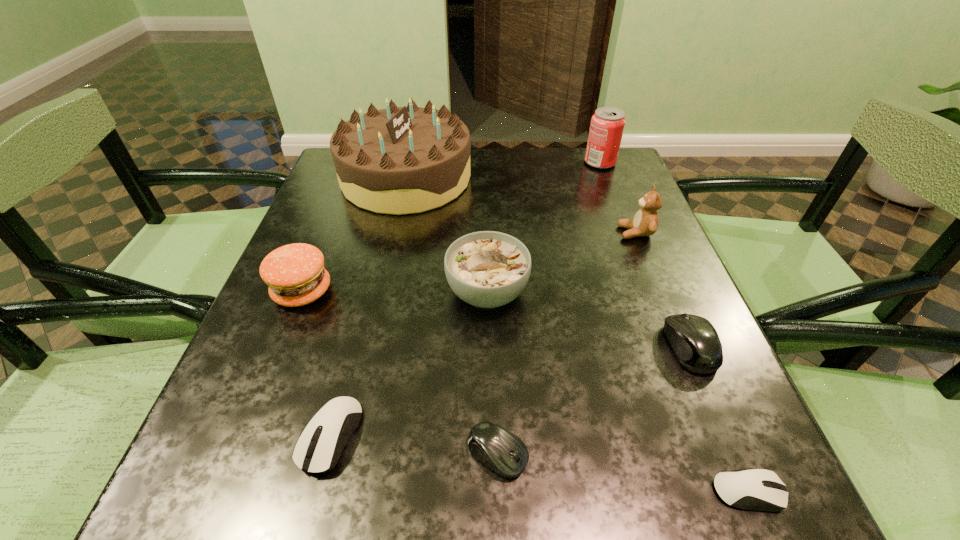
What are the coordinates of `mouse that is at the left edge` in the screenshot? It's located at (337, 420).

Image resolution: width=960 pixels, height=540 pixels. I want to click on soda can that is positioned at the right edge, so click(607, 125).

In order to click on teddy bear positioned at the right edge in this screenshot , I will do `click(645, 222)`.

At what (x,y) coordinates should I click in order to perform the action: click on object situated at the far left corner. Please return your answer as a coordinate pair (x, y). This screenshot has width=960, height=540. Looking at the image, I should click on (400, 160).

The image size is (960, 540). Identify the location of object located at the near left corner. (337, 420).

Identify the location of object that is at the far right corner. The image size is (960, 540). click(x=607, y=125).

Find the location of a particular element. object that is at the near right corner is located at coordinates (760, 489).

Image resolution: width=960 pixels, height=540 pixels. Find the location of `vacant space at the near edge`. vacant space at the near edge is located at coordinates (473, 507).

The width and height of the screenshot is (960, 540). I want to click on free region at the left edge of the desktop, so click(324, 239).

You are a GUI agent. You are given a task and a screenshot of the screen. Output one action in this format:
    pyautogui.click(x=<x>, y=<y>)
    Task: Click on the free region at the right edge of the desktop
    The width and height of the screenshot is (960, 540).
    Given the screenshot: What is the action you would take?
    pyautogui.click(x=707, y=383)